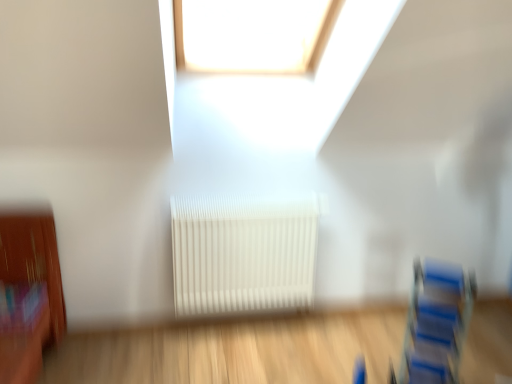
This screenshot has height=384, width=512. Describe the element at coordinates (243, 253) in the screenshot. I see `white ribbed radiator at center` at that location.

I want to click on white ribbed radiator at center, so click(243, 253).

What is the approximate width of white ribbed radiator at center?

white ribbed radiator at center is 5.13 inches in width.

This screenshot has width=512, height=384. What are the coordinates of `white ribbed radiator at center` in the screenshot? It's located at (243, 253).